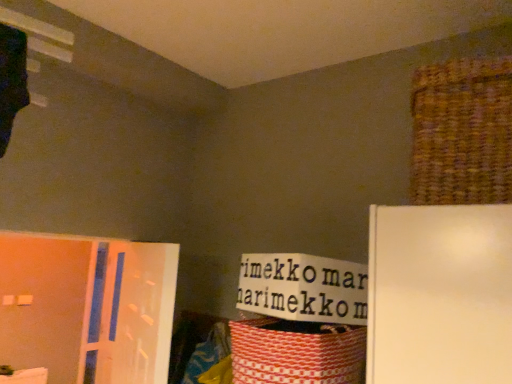
Question: Should I look upward or downward to see red woven basket at lower right, marked as the 2th basket in a top-to-bottom arrangement?

Choices:
 (A) up
 (B) down

Answer: (B)

Question: Can you confirm if translucent plastic screen door at left is wider than brown woven basket at upper right, which appears as the 1th basket when viewed from the top?

Choices:
 (A) yes
 (B) no

Answer: (B)

Question: Is translucent plastic screen door at left outside brown woven basket at upper right, which appears as the 2th basket when viewed from the left?

Choices:
 (A) no
 (B) yes

Answer: (B)

Question: Is translucent plastic screen door at left far away from brown woven basket at upper right, which is the 2th basket from bottom to top?

Choices:
 (A) yes
 (B) no

Answer: (A)

Question: Considering the relative positions of translucent plastic screen door at left and brown woven basket at upper right, which appears as the 1th basket when viewed from the top, in the image provided, is translucent plastic screen door at left behind brown woven basket at upper right, which appears as the 1th basket when viewed from the top,?

Choices:
 (A) no
 (B) yes

Answer: (B)

Question: Can you confirm if translucent plastic screen door at left is positioned to the right of brown woven basket at upper right, which appears as the 1th basket when viewed from the top?

Choices:
 (A) yes
 (B) no

Answer: (B)

Question: Is translucent plastic screen door at left next to brown woven basket at upper right, the first basket when ordered from right to left?

Choices:
 (A) no
 (B) yes

Answer: (A)

Question: Considering the relative positions of red woven basket at lower right, positioned as the second basket in right-to-left order, and translucent plastic screen door at left in the image provided, is red woven basket at lower right, positioned as the second basket in right-to-left order, to the right of translucent plastic screen door at left from the viewer's perspective?

Choices:
 (A) yes
 (B) no

Answer: (A)

Question: Does red woven basket at lower right, marked as the 1th basket in a bottom-to-top arrangement, come behind translucent plastic screen door at left?

Choices:
 (A) no
 (B) yes

Answer: (A)

Question: Does red woven basket at lower right, positioned as the second basket in right-to-left order, turn towards translucent plastic screen door at left?

Choices:
 (A) yes
 (B) no

Answer: (B)

Question: Is red woven basket at lower right, marked as the 1th basket in a bottom-to-top arrangement, positioned far away from translucent plastic screen door at left?

Choices:
 (A) no
 (B) yes

Answer: (A)

Question: From the image's perspective, is red woven basket at lower right, marked as the 2th basket in a top-to-bottom arrangement, above translucent plastic screen door at left?

Choices:
 (A) no
 (B) yes

Answer: (B)

Question: Does red woven basket at lower right, which is the 1th basket from left to right, have a lesser width compared to translucent plastic screen door at left?

Choices:
 (A) no
 (B) yes

Answer: (A)

Question: Can you see red woven basket at lower right, positioned as the second basket in right-to-left order, touching brown woven basket at upper right, which appears as the 2th basket when viewed from the left?

Choices:
 (A) no
 (B) yes

Answer: (A)